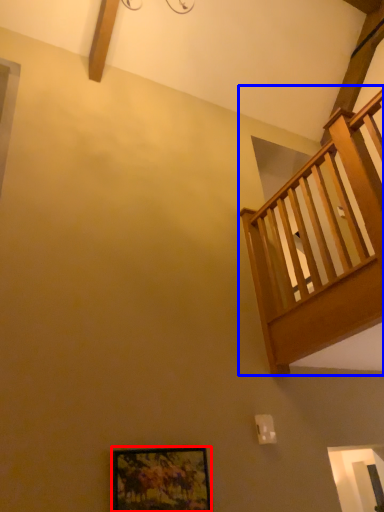
Question: Which point is closer to the camera, picture frame (highlighted by a red box) or balcony (highlighted by a blue box)?

Choices:
 (A) picture frame
 (B) balcony

Answer: (B)